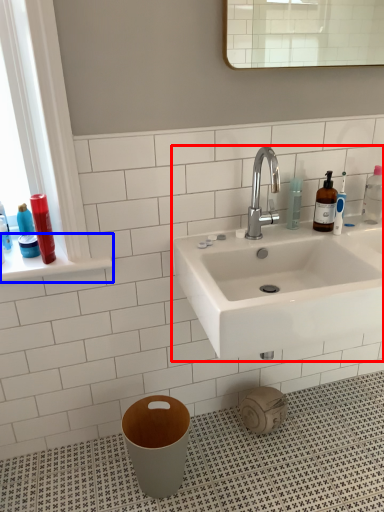
Question: Which of the following is the closest to the observer, sink (highlighted by a red box) or window sill (highlighted by a blue box)?

Choices:
 (A) sink
 (B) window sill

Answer: (A)